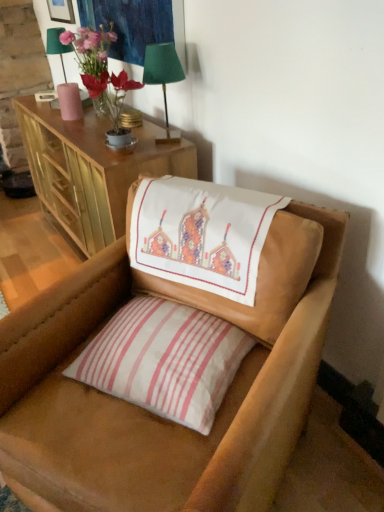
Question: From their relative heights in the image, would you say white striped pillow at center is taller or shorter than leather chair at center?

Choices:
 (A) tall
 (B) short

Answer: (B)

Question: Looking at the image, does white striped pillow at center seem bigger or smaller compared to leather chair at center?

Choices:
 (A) big
 (B) small

Answer: (B)

Question: Which object is the closest to the green fabric lampshade at upper left, the 1th table lamp when ordered from top to bottom?

Choices:
 (A) leather chair at center
 (B) matte glass vase at upper left
 (C) green fabric lampshade at upper center, positioned as the second table lamp in back-to-front order
 (D) white striped pillow at center
 (E) wooden picture frame at upper left

Answer: (B)

Question: Which of these objects is positioned closest to the green fabric lampshade at upper center, the 1th table lamp from the right?

Choices:
 (A) white striped pillow at center
 (B) embroidered fabric at upper left
 (C) wooden picture frame at upper left
 (D) green fabric lampshade at upper left, which ranks as the second table lamp in bottom-to-top order
 (E) wooden cabinet at upper left

Answer: (B)